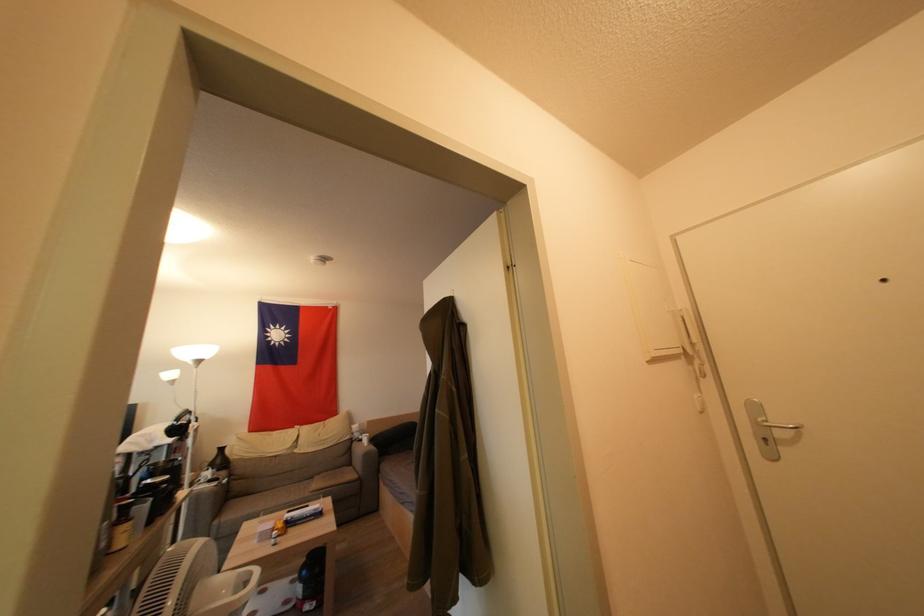
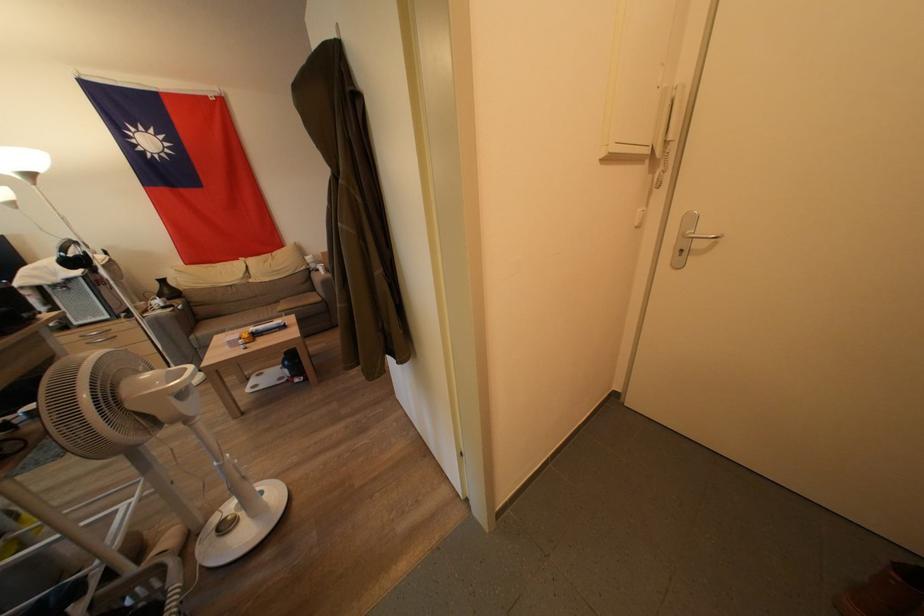
Where in the second image is the point corresponding to pixel 256 577 from the first image?

(190, 373)